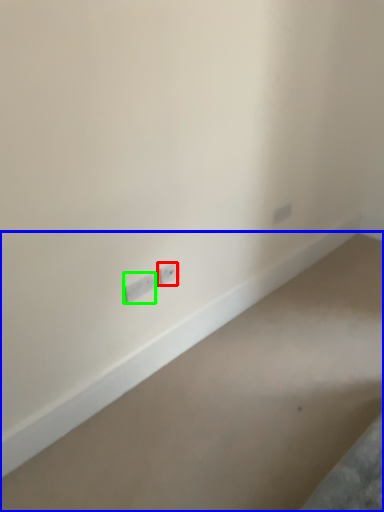
Question: Based on their relative distances, which object is farther from power plugs and sockets (highlighted by a red box)? Choose from concrete (highlighted by a blue box) and power plugs and sockets (highlighted by a green box).

Choices:
 (A) concrete
 (B) power plugs and sockets

Answer: (A)